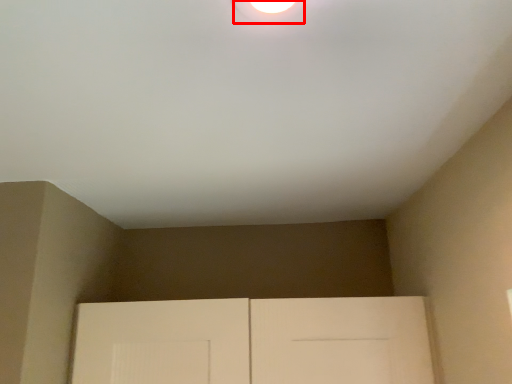
Question: In this image, where is droplight (annotated by the red box) located relative to door?

Choices:
 (A) right
 (B) left

Answer: (A)